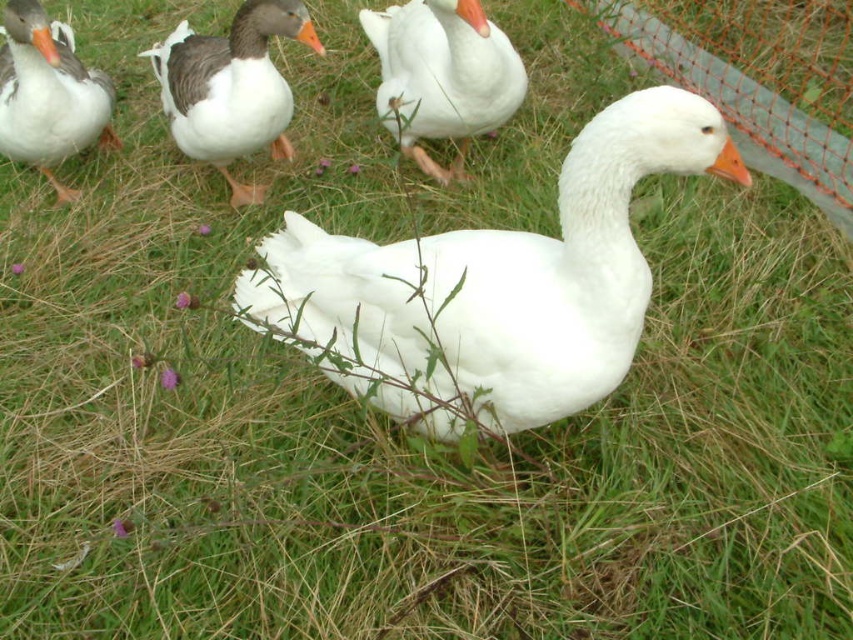
Question: Does white matte goose at center appear on the left side of white matte goose at upper center?

Choices:
 (A) no
 (B) yes

Answer: (A)

Question: Can you confirm if white matte goose at center is positioned to the left of gray matte duck at upper left?

Choices:
 (A) yes
 (B) no

Answer: (B)

Question: Based on their relative distances, which object is nearer to the gray matte duck at upper left?

Choices:
 (A) matte gray duck at upper left
 (B) white matte goose at center

Answer: (A)

Question: Which of these objects is positioned closest to the white matte goose at upper center?

Choices:
 (A) matte gray duck at upper left
 (B) gray matte duck at upper left
 (C) white matte goose at center

Answer: (B)

Question: Which point is closer to the camera?

Choices:
 (A) (469, 52)
 (B) (178, 129)
 (C) (28, 60)
 (D) (376, 282)

Answer: (D)

Question: Is the position of white matte goose at center less distant than that of gray matte duck at upper left?

Choices:
 (A) no
 (B) yes

Answer: (B)